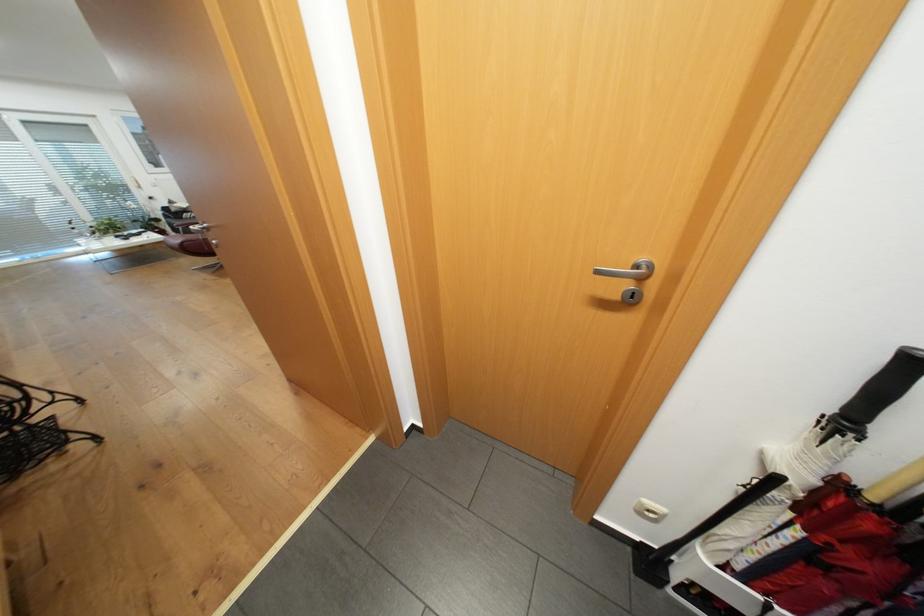
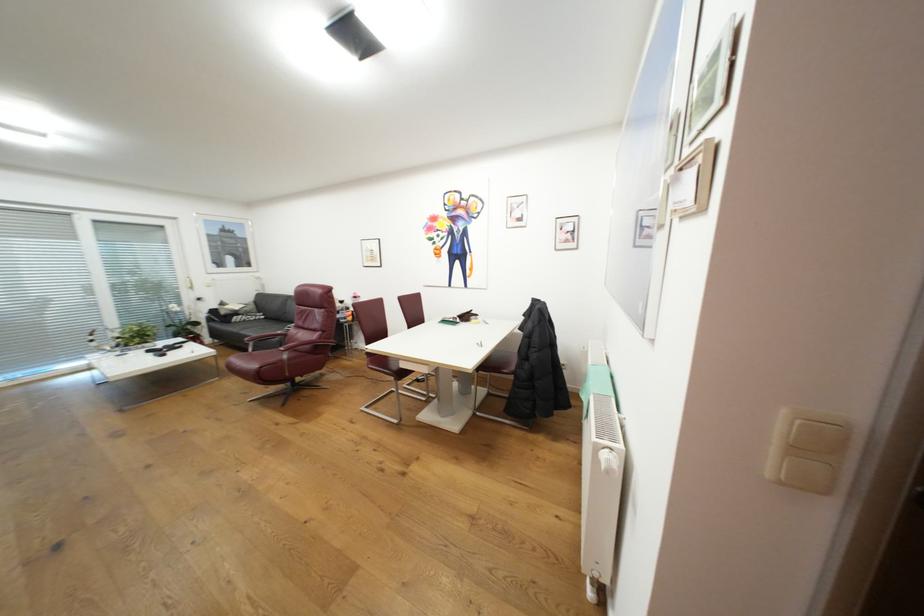
The point at (193, 215) is marked in the first image. Where is the corresponding point in the second image?

(244, 318)